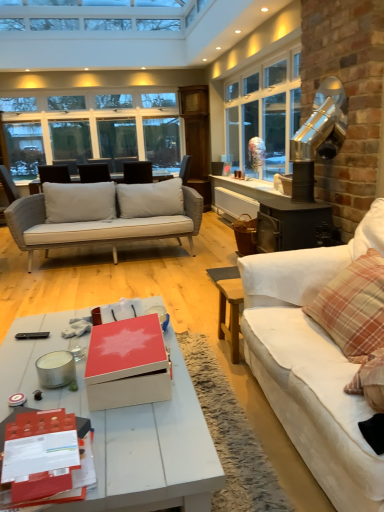
Identify the location of free spot above white painted wood coffee table at lower center (from a real-world perspective). (77, 396).